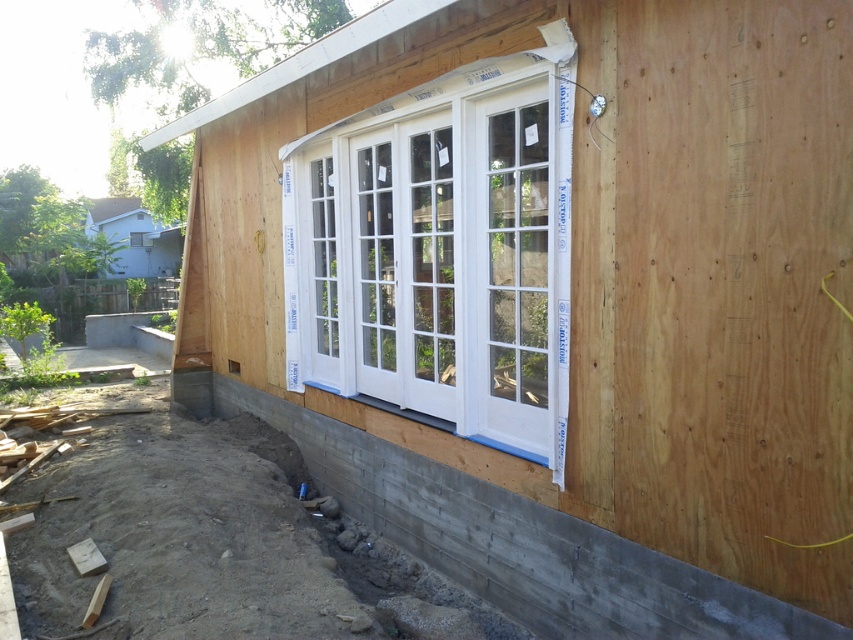
You are a construction worker standing at the point with coordinates point (440, 253). You need to move to the white French doors with multiple glass panes on the exterior wall. Which direction should you go?

The point (440, 253) corresponds to the white painted wood bay window at center, so you should move towards the exterior wall where the white French doors with multiple glass panes are installed to reach them.

You are a construction worker standing at the construction site. You notice two points marked on the wall where you need to install safety sensors. The first point is at point (357, 208) and the second is at point (672, 618). Which point is closer to you?

Point (357, 208) is further to the viewer than point (672, 618), so the point closer to you is point (672, 618).